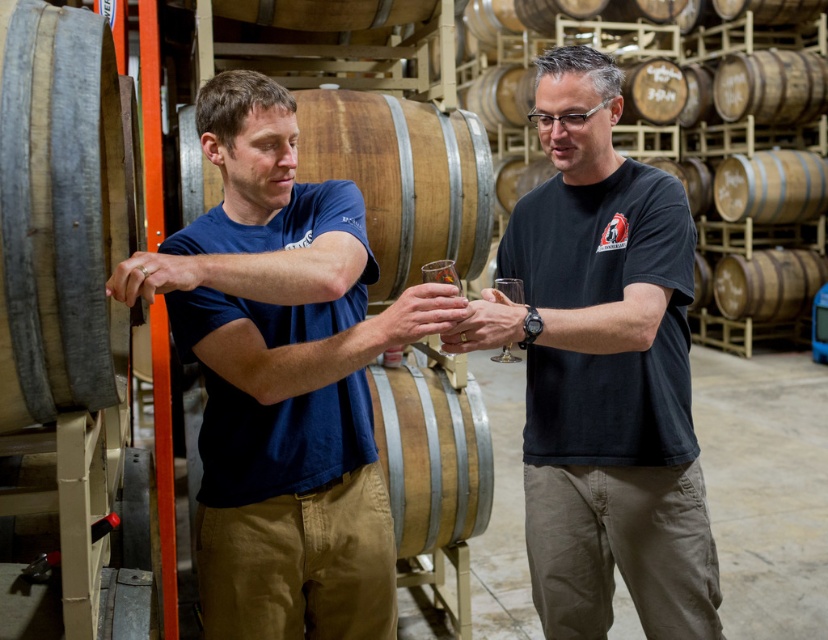
You are a winery tour guide and need to explain the differences between the barrels. Which barrel has a smaller diameter, the smooth gray wood barrel at left or the light brown wood barrel at center?

The smooth gray wood barrel at left has a smaller diameter than the light brown wood barrel at center.